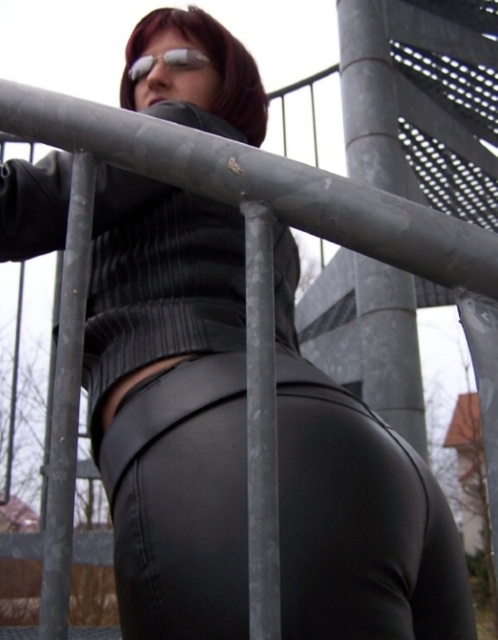
Question: Does black leather leggings at center appear on the left side of shiny silver goggles at upper center?

Choices:
 (A) no
 (B) yes

Answer: (A)

Question: Which is farther from the shiny silver goggles at upper center?

Choices:
 (A) black leather leggings at center
 (B) metallic gray pole at center

Answer: (B)

Question: Is metallic gray pole at center to the right of shiny silver goggles at upper center from the viewer's perspective?

Choices:
 (A) no
 (B) yes

Answer: (A)

Question: Which point is farther from the camera taking this photo?

Choices:
 (A) (189, 596)
 (B) (77, 369)

Answer: (A)

Question: Which object is farther from the camera taking this photo?

Choices:
 (A) gray textured pole at center
 (B) shiny silver goggles at upper center

Answer: (B)

Question: Is black leather leggings at center wider than gray textured pole at center?

Choices:
 (A) yes
 (B) no

Answer: (A)